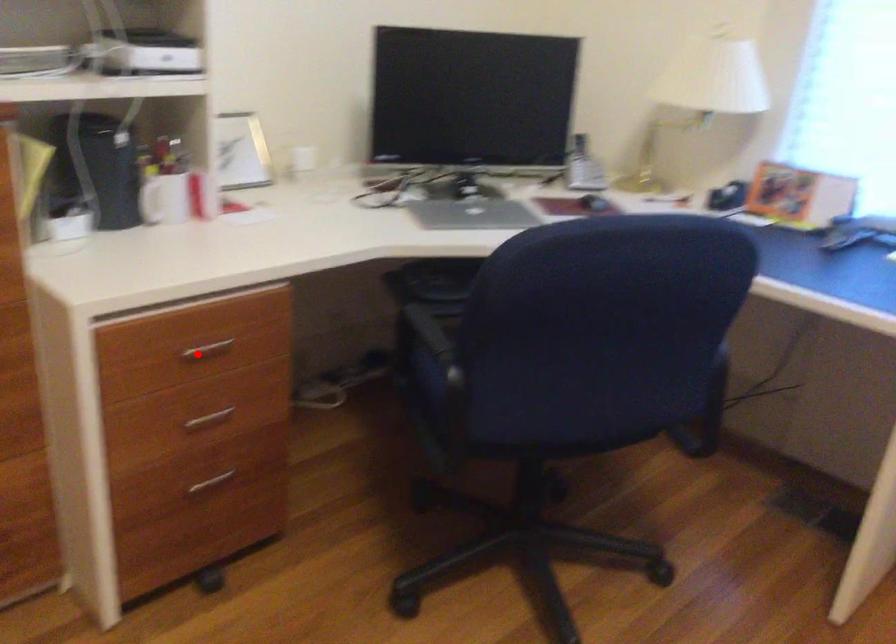
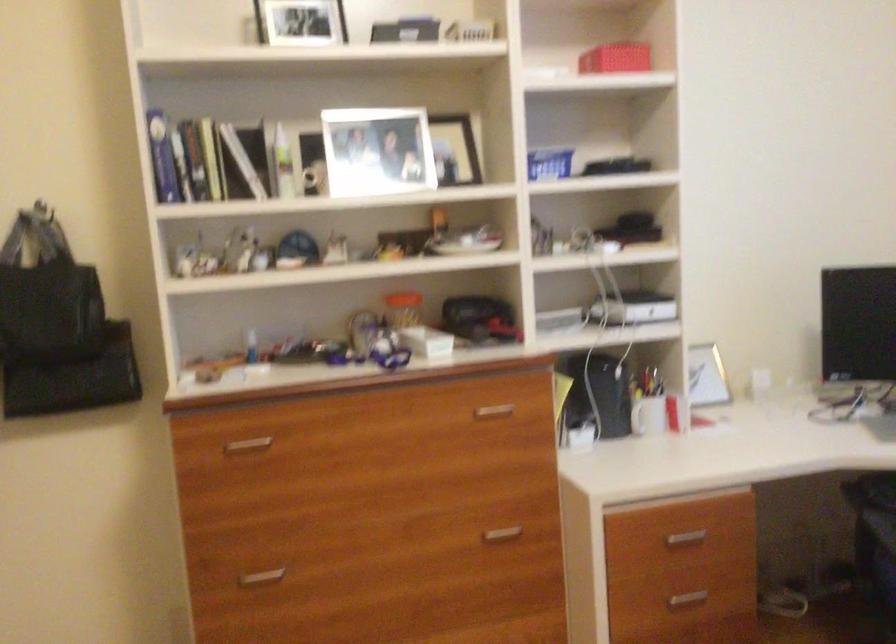
Where in the second image is the point corresponding to the highlighted location from the first image?

(685, 538)